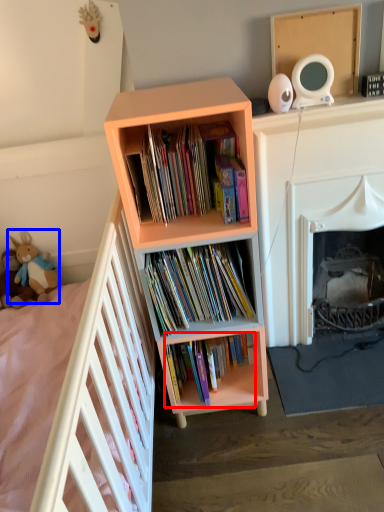
Question: Which of the following is the closest to the observer, book (highlighted by a red box) or toy (highlighted by a blue box)?

Choices:
 (A) book
 (B) toy

Answer: (A)